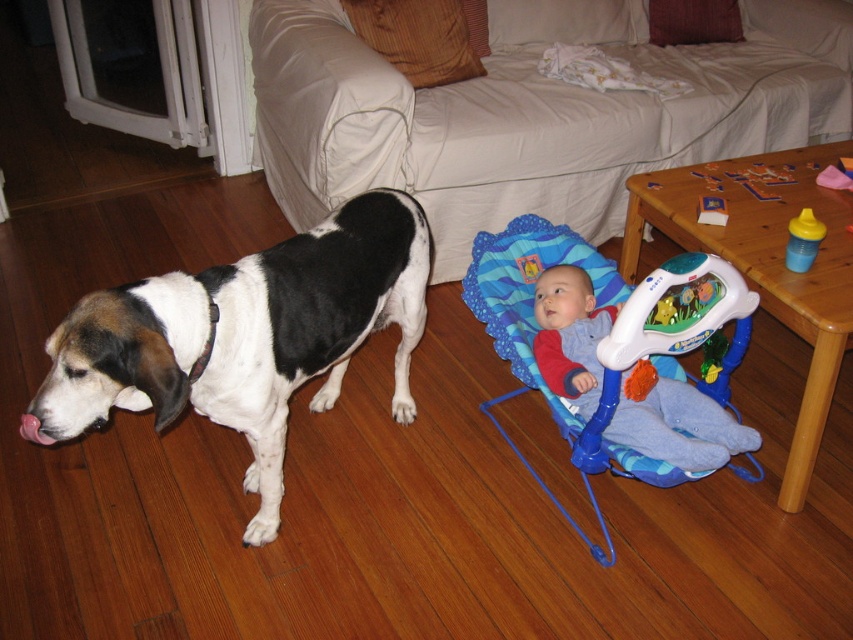
Question: Does blue plush baby seat at lower right come in front of yellow plastic sippy cup at right?

Choices:
 (A) no
 (B) yes

Answer: (B)

Question: Does blue plush baby seat at lower right appear under yellow plastic sippy cup at right?

Choices:
 (A) yes
 (B) no

Answer: (A)

Question: Can you confirm if yellow plastic sippy cup at right is positioned below matte plastic toy at center?

Choices:
 (A) yes
 (B) no

Answer: (A)

Question: Which point is farther to the camera?

Choices:
 (A) (705, 220)
 (B) (604, 442)
 (C) (809, 240)

Answer: (A)

Question: Which point is farther to the camera?

Choices:
 (A) (540, 259)
 (B) (805, 262)
 (C) (706, 205)
 (D) (679, 385)

Answer: (A)

Question: Based on their relative distances, which object is farther from the black and white fur at left?

Choices:
 (A) matte plastic toy at center
 (B) yellow plastic sippy cup at right

Answer: (B)